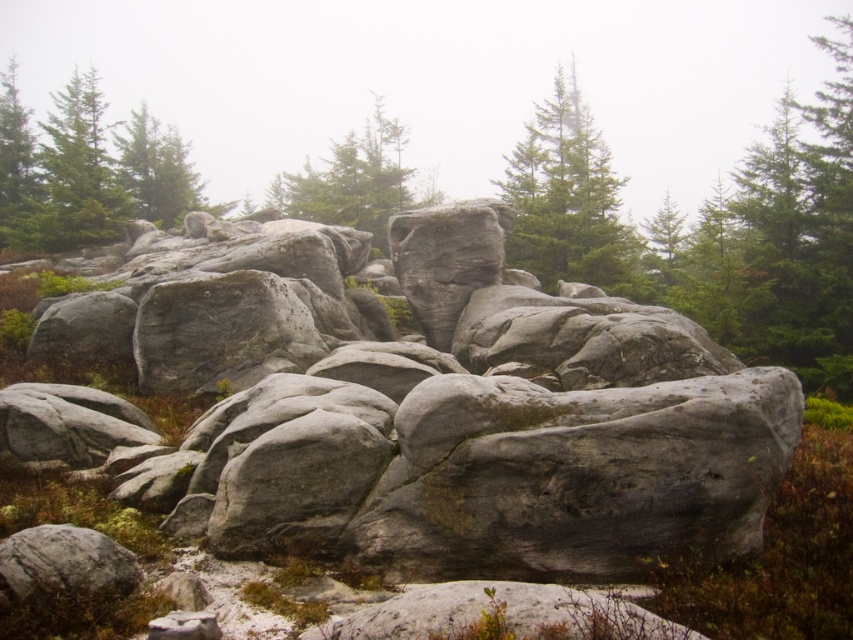
You are a hiker standing at the edge of the forest. You see the gray rough rock at center and the green matte tree at center. Which object is closer to you?

The gray rough rock at center is closer to you because it is in front of the green matte tree at center.

You are hiking in this rugged landscape and want to take a photo of the green matte tree at upper left and the green matte tree at center. Which tree appears closer to the camera in the photo?

The green matte tree at upper left appears closer to the camera because it is positioned over the green matte tree at center, indicating it is in front.